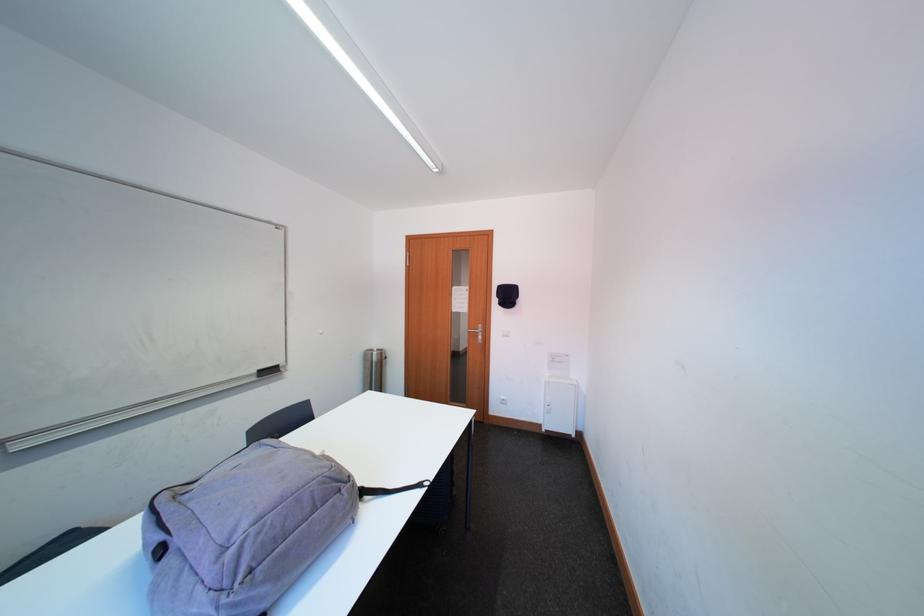
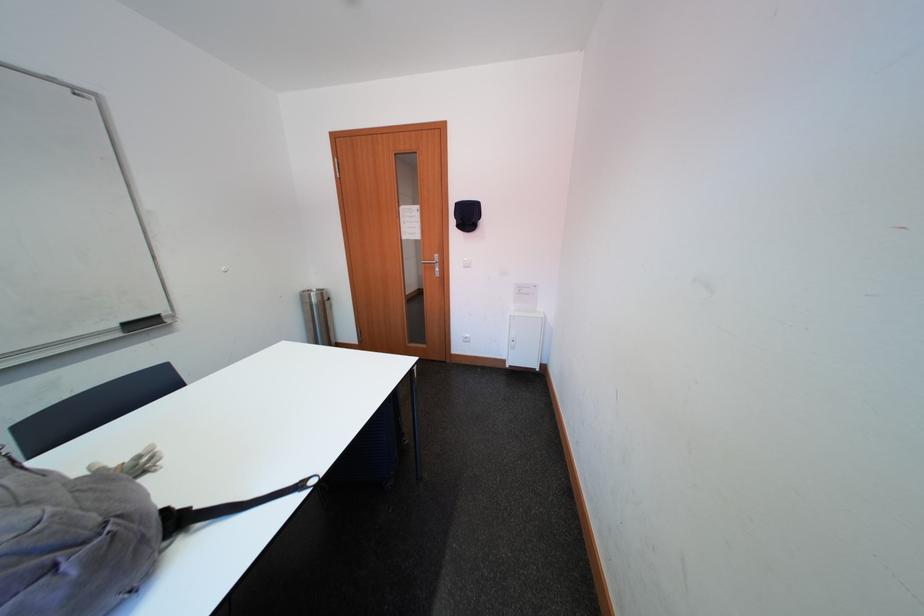
Question: The images are taken continuously from a first-person perspective. In which direction is your viewpoint rotating?

Choices:
 (A) Left
 (B) Right
 (C) Up
 (D) Down

Answer: (D)